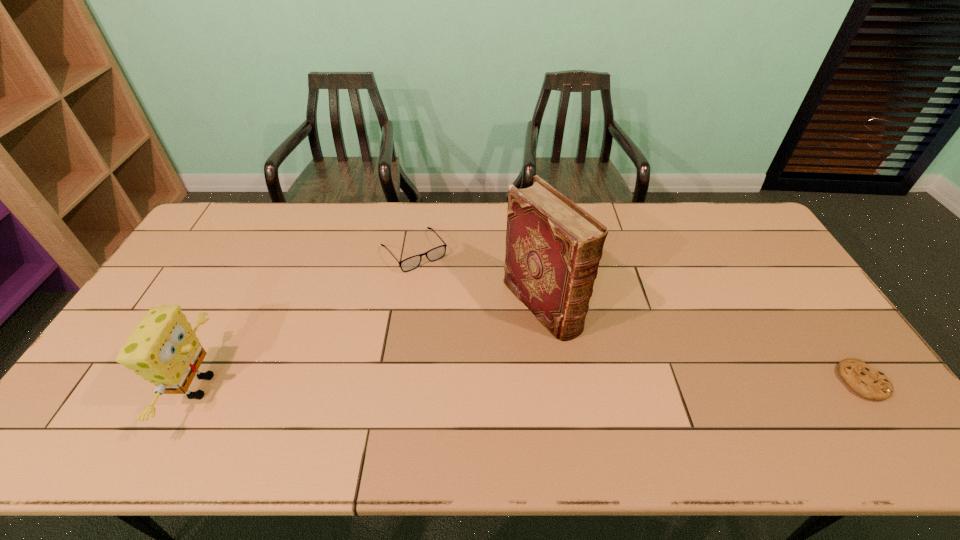
Locate an element on the screen. object present at the near right corner is located at coordinates (869, 383).

You are a GUI agent. You are given a task and a screenshot of the screen. Output one action in this format:
    pyautogui.click(x=<x>, y=<y>)
    Task: Click on the vacant space at the far edge
    This screenshot has height=540, width=960.
    Given the screenshot: What is the action you would take?
    pyautogui.click(x=499, y=201)

Image resolution: width=960 pixels, height=540 pixels. Find the location of `free location at the near edge of the desktop`. free location at the near edge of the desktop is located at coordinates [364, 400].

Image resolution: width=960 pixels, height=540 pixels. Find the location of `vacant space at the left edge`. vacant space at the left edge is located at coordinates (227, 266).

Identify the location of free space at the right edge. The height and width of the screenshot is (540, 960). (790, 347).

This screenshot has height=540, width=960. Find the location of `vacant space at the far left corner`. vacant space at the far left corner is located at coordinates (228, 233).

The image size is (960, 540). Find the location of `vacant area at the near left corner`. vacant area at the near left corner is located at coordinates (108, 386).

The image size is (960, 540). What are the coordinates of `vacant region at the far right corner of the desktop` in the screenshot? It's located at (734, 204).

In the image, there is a desktop. At what (x,y) coordinates should I click in order to perform the action: click on vacant region at the near right corner. Please return your answer as a coordinate pair (x, y). Looking at the image, I should click on (835, 387).

You are a GUI agent. You are given a task and a screenshot of the screen. Output one action in this format:
    pyautogui.click(x=<x>, y=<y>)
    Task: Click on the vacant area that lies between the spectacles and the sponge
    The height and width of the screenshot is (540, 960).
    Given the screenshot: What is the action you would take?
    pyautogui.click(x=307, y=319)